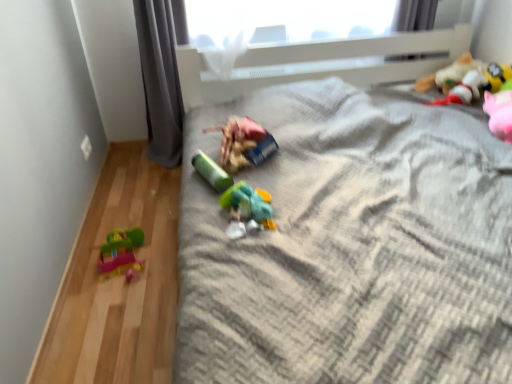
The width and height of the screenshot is (512, 384). What do you see at coordinates (160, 80) in the screenshot? I see `gray fabric curtain at left` at bounding box center [160, 80].

In order to click on matte plastic toy at center, the fourth toy when ordered from right to left in this screenshot , I will do tap(243, 143).

What is the approximate height of plastic toy car at left, the first toy from the left?

The height of plastic toy car at left, the first toy from the left, is 3.88 inches.

Locate an element on the screen. gray fabric curtain at left is located at coordinates (160, 80).

Is matte plastic toy at center, the third toy from the left, taller than plastic toy car at left, which is counted as the 6th toy, starting from the right?

Correct, matte plastic toy at center, the third toy from the left, is much taller as plastic toy car at left, which is counted as the 6th toy, starting from the right.

Looking at their sizes, would you say matte plastic toy at center, the third toy from the left, is wider or thinner than plastic toy car at left, which is counted as the 6th toy, starting from the right?

matte plastic toy at center, the third toy from the left, is wider than plastic toy car at left, which is counted as the 6th toy, starting from the right.

This screenshot has height=384, width=512. What are the coordinates of `toy that is the 2nd one when counting leftward from the matte plastic toy at center, the third toy from the left` in the screenshot? It's located at (120, 252).

Is matte plastic toy at center, the fourth toy when ordered from right to left, turned away from plastic toy car at left, the first toy from the left?

matte plastic toy at center, the fourth toy when ordered from right to left, is not turned away from plastic toy car at left, the first toy from the left.

From a real-world perspective, which is physically above, plastic toy car at left, which is counted as the 6th toy, starting from the right, or plush yellow toy at upper right, the 6th toy when ordered from left to right?

From a 3D spatial view, plush yellow toy at upper right, the 6th toy when ordered from left to right, is above.

Measure the distance between plastic toy car at left, which is counted as the 6th toy, starting from the right, and plush yellow toy at upper right, the 6th toy when ordered from left to right.

1.96 meters.

Considering the relative sizes of plastic toy car at left, the first toy from the left, and plush yellow toy at upper right, arranged as the 1th toy when viewed from the right, in the image provided, is plastic toy car at left, the first toy from the left, wider than plush yellow toy at upper right, arranged as the 1th toy when viewed from the right,?

Indeed, plastic toy car at left, the first toy from the left, has a greater width compared to plush yellow toy at upper right, arranged as the 1th toy when viewed from the right.

From the image's perspective, is plastic toy car at left, the first toy from the left, positioned above or below plush yellow toy at upper right, arranged as the 1th toy when viewed from the right?

plastic toy car at left, the first toy from the left, is situated lower than plush yellow toy at upper right, arranged as the 1th toy when viewed from the right, in the image.

Could you tell me if plush yellow toy at upper right, arranged as the 1th toy when viewed from the right, is turned towards plastic toy car at left, the first toy from the left?

Yes, plush yellow toy at upper right, arranged as the 1th toy when viewed from the right, is aimed at plastic toy car at left, the first toy from the left.

From the image's perspective, which toy is the 5th one below the plush yellow toy at upper right, arranged as the 1th toy when viewed from the right? Please provide its 2D coordinates.

[(120, 252)]

From the image's perspective, relative to plastic toy car at left, which is counted as the 6th toy, starting from the right, is plush yellow toy at upper right, the 6th toy when ordered from left to right, above or below?

plush yellow toy at upper right, the 6th toy when ordered from left to right, is above plastic toy car at left, which is counted as the 6th toy, starting from the right.

Does gray textured blanket at center turn towards plastic toy car at left, which is counted as the 6th toy, starting from the right?

No, gray textured blanket at center is not oriented towards plastic toy car at left, which is counted as the 6th toy, starting from the right.

From the image's perspective, is gray textured blanket at center positioned above or below plastic toy car at left, which is counted as the 6th toy, starting from the right?

gray textured blanket at center is situated higher than plastic toy car at left, which is counted as the 6th toy, starting from the right, in the image.

Would you say gray textured blanket at center contains plastic toy car at left, which is counted as the 6th toy, starting from the right?

That's incorrect, plastic toy car at left, which is counted as the 6th toy, starting from the right, is not inside gray textured blanket at center.

Based on their sizes in the image, would you say gray textured blanket at center is bigger or smaller than plastic toy car at left, which is counted as the 6th toy, starting from the right?

gray textured blanket at center is bigger than plastic toy car at left, which is counted as the 6th toy, starting from the right.

Between point (201, 160) and point (164, 19), which one is positioned behind?

The point (164, 19) is farther.

Is there a large distance between green matte cylinder at center, the 2th toy from the left, and gray fabric curtain at left?

Result: No, green matte cylinder at center, the 2th toy from the left, is in close proximity to gray fabric curtain at left.

Which is more to the right, green matte cylinder at center, acting as the fifth toy starting from the right, or gray fabric curtain at left?

Positioned to the right is green matte cylinder at center, acting as the fifth toy starting from the right.

From the image's perspective, between green matte cylinder at center, acting as the fifth toy starting from the right, and gray fabric curtain at left, who is located below?

green matte cylinder at center, acting as the fifth toy starting from the right, from the image's perspective.

Which object is thinner, fuzzy fabric stuffed animal at upper right, which is the 2th toy in right-to-left order, or translucent plastic toy at center, which is the fourth toy from left to right?

With smaller width is translucent plastic toy at center, which is the fourth toy from left to right.

Could you tell me if fuzzy fabric stuffed animal at upper right, which is the 2th toy in right-to-left order, is turned towards translucent plastic toy at center, positioned as the third toy in right-to-left order?

No, fuzzy fabric stuffed animal at upper right, which is the 2th toy in right-to-left order, is not oriented towards translucent plastic toy at center, positioned as the third toy in right-to-left order.

Measure the distance from fuzzy fabric stuffed animal at upper right, which is the 2th toy in right-to-left order, to translucent plastic toy at center, which is the fourth toy from left to right.

fuzzy fabric stuffed animal at upper right, which is the 2th toy in right-to-left order, is 4.58 feet from translucent plastic toy at center, which is the fourth toy from left to right.

Which of these two, fuzzy fabric stuffed animal at upper right, marked as the 5th toy in a left-to-right arrangement, or translucent plastic toy at center, positioned as the third toy in right-to-left order, stands taller?

Answer: fuzzy fabric stuffed animal at upper right, marked as the 5th toy in a left-to-right arrangement, is taller.

Are plastic toy car at left, which is counted as the 6th toy, starting from the right, and matte plastic toy at center, the third toy from the left, far apart?

Actually, plastic toy car at left, which is counted as the 6th toy, starting from the right, and matte plastic toy at center, the third toy from the left, are a little close together.

Is plastic toy car at left, the first toy from the left, oriented away from matte plastic toy at center, the third toy from the left?

No, plastic toy car at left, the first toy from the left,'s orientation is not away from matte plastic toy at center, the third toy from the left.

Can you tell me how much plastic toy car at left, the first toy from the left, and matte plastic toy at center, the fourth toy when ordered from right to left, differ in facing direction?

plastic toy car at left, the first toy from the left, and matte plastic toy at center, the fourth toy when ordered from right to left, are facing 89.8 degrees away from each other.

Which is correct: plastic toy car at left, which is counted as the 6th toy, starting from the right, is inside matte plastic toy at center, the fourth toy when ordered from right to left, or outside of it?

plastic toy car at left, which is counted as the 6th toy, starting from the right, is located beyond the bounds of matte plastic toy at center, the fourth toy when ordered from right to left.

From a real-world perspective, starting from the matte plastic toy at center, the fourth toy when ordered from right to left, which toy is the 3rd one below it? Please provide its 2D coordinates.

[(120, 252)]

From the plush yellow toy at upper right, arranged as the 1th toy when viewed from the right, count 2nd toys forward and point to it. Please provide its 2D coordinates.

[(120, 252)]

Considering their positions, is gray textured blanket at center positioned closer to green matte cylinder at center, acting as the fifth toy starting from the right, than translucent plastic toy at center, which is the fourth toy from left to right?

translucent plastic toy at center, which is the fourth toy from left to right, is closer to green matte cylinder at center, acting as the fifth toy starting from the right.

Looking at the image, which one is located further to matte plastic toy at center, the fourth toy when ordered from right to left, green matte cylinder at center, acting as the fifth toy starting from the right, or fuzzy fabric stuffed animal at upper right, which is the 2th toy in right-to-left order?

fuzzy fabric stuffed animal at upper right, which is the 2th toy in right-to-left order, is positioned further to the anchor matte plastic toy at center, the fourth toy when ordered from right to left.

Estimate the real-world distances between objects in this image. Which object is closer to fuzzy fabric stuffed animal at upper right, which is the 2th toy in right-to-left order, matte plastic toy at center, the fourth toy when ordered from right to left, or plush yellow toy at upper right, the 6th toy when ordered from left to right?

Among the two, plush yellow toy at upper right, the 6th toy when ordered from left to right, is located nearer to fuzzy fabric stuffed animal at upper right, which is the 2th toy in right-to-left order.

Looking at this image, which object lies further to the anchor point fuzzy fabric stuffed animal at upper right, marked as the 5th toy in a left-to-right arrangement, gray textured blanket at center or green matte cylinder at center, the 2th toy from the left?

Based on the image, green matte cylinder at center, the 2th toy from the left, appears to be further to fuzzy fabric stuffed animal at upper right, marked as the 5th toy in a left-to-right arrangement.

Estimate the real-world distances between objects in this image. Which object is closer to translucent plastic toy at center, positioned as the third toy in right-to-left order, fuzzy fabric stuffed animal at upper right, which is the 2th toy in right-to-left order, or gray fabric curtain at left?

Based on the image, gray fabric curtain at left appears to be nearer to translucent plastic toy at center, positioned as the third toy in right-to-left order.

When comparing their distances from fuzzy fabric stuffed animal at upper right, marked as the 5th toy in a left-to-right arrangement, does gray textured blanket at center or gray fabric curtain at left seem further?

gray fabric curtain at left is further to fuzzy fabric stuffed animal at upper right, marked as the 5th toy in a left-to-right arrangement.

Estimate the real-world distances between objects in this image. Which object is further from matte plastic toy at center, the third toy from the left, plastic toy car at left, the first toy from the left, or gray fabric curtain at left?

The object further to matte plastic toy at center, the third toy from the left, is gray fabric curtain at left.

When comparing their distances from gray textured blanket at center, does plush yellow toy at upper right, the 6th toy when ordered from left to right, or matte plastic toy at center, the fourth toy when ordered from right to left, seem closer?

matte plastic toy at center, the fourth toy when ordered from right to left, is closer to gray textured blanket at center.

At what (x,y) coordinates should I click in order to perform the action: click on toy located between matte plastic toy at center, the fourth toy when ordered from right to left, and fuzzy fabric stuffed animal at upper right, marked as the 5th toy in a left-to-right arrangement, in the left-right direction. Please return your answer as a coordinate pair (x, y). The image size is (512, 384). Looking at the image, I should click on (247, 209).

Locate an element on the screen. This screenshot has width=512, height=384. toy situated between plastic toy car at left, which is counted as the 6th toy, starting from the right, and matte plastic toy at center, the fourth toy when ordered from right to left, from left to right is located at coordinates (211, 172).

The height and width of the screenshot is (384, 512). I want to click on bed between gray fabric curtain at left and plush yellow toy at upper right, arranged as the 1th toy when viewed from the right, in the horizontal direction, so click(x=351, y=245).

Where is `toy between translucent plastic toy at center, which is the fourth toy from left to right, and plush yellow toy at upper right, arranged as the 1th toy when viewed from the right`? Image resolution: width=512 pixels, height=384 pixels. toy between translucent plastic toy at center, which is the fourth toy from left to right, and plush yellow toy at upper right, arranged as the 1th toy when viewed from the right is located at coordinates (465, 79).